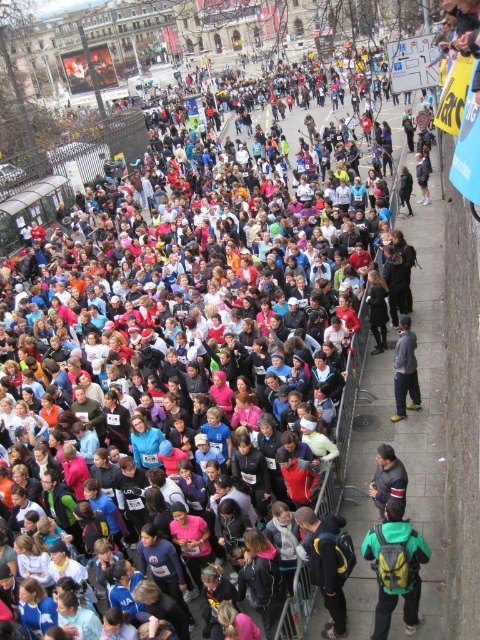
Question: In this image, where is dark blue jacket at center located relative to dark gray sweater at lower right?

Choices:
 (A) below
 (B) above

Answer: (A)

Question: Is green/yellow backpack at center thinner than dark gray sweater at lower right?

Choices:
 (A) no
 (B) yes

Answer: (A)

Question: Which of the following is the farthest from the observer?

Choices:
 (A) (301, 529)
 (B) (409, 616)

Answer: (A)

Question: Which object is closer to the camera taking this photo?

Choices:
 (A) green/yellow backpack at center
 (B) dark blue jacket at center
 (C) dark gray sweater at lower right

Answer: (A)

Question: Which of these objects is positioned farthest from the gray fabric jacket at center?

Choices:
 (A) dark gray sweater at lower right
 (B) dark blue jacket at center
 (C) green/yellow backpack at center

Answer: (B)

Question: Does green/yellow backpack at center appear on the right side of gray fabric jacket at center?

Choices:
 (A) yes
 (B) no

Answer: (B)